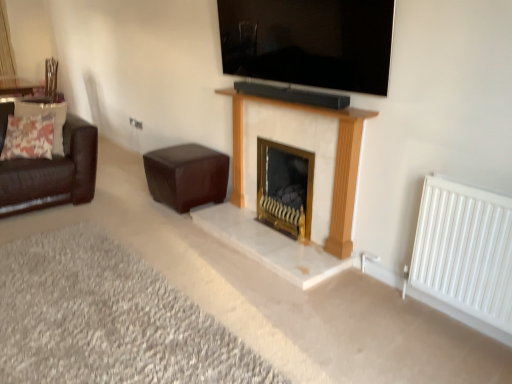
Question: Considering the positions of point (44, 114) and point (345, 13), is point (44, 114) closer or farther from the camera than point (345, 13)?

Choices:
 (A) closer
 (B) farther

Answer: (B)

Question: From a real-world perspective, is floral fabric pillow at left positioned above or below black glossy tv at upper center?

Choices:
 (A) above
 (B) below

Answer: (B)

Question: Considering the real-world distances, which object is farthest from the white metal radiator at right?

Choices:
 (A) leather couch at left
 (B) white marble fireplace at center
 (C) white fabric curtain at upper left
 (D) black glossy tv at upper center
 (E) white shaggy carpet at lower left

Answer: (C)

Question: Estimate the real-world distances between objects in this image. Which object is farther from the white shaggy carpet at lower left?

Choices:
 (A) white marble fireplace at center
 (B) white metal radiator at right
 (C) floral fabric pillow at left
 (D) black glossy tv at upper center
 (E) white fabric curtain at upper left

Answer: (E)